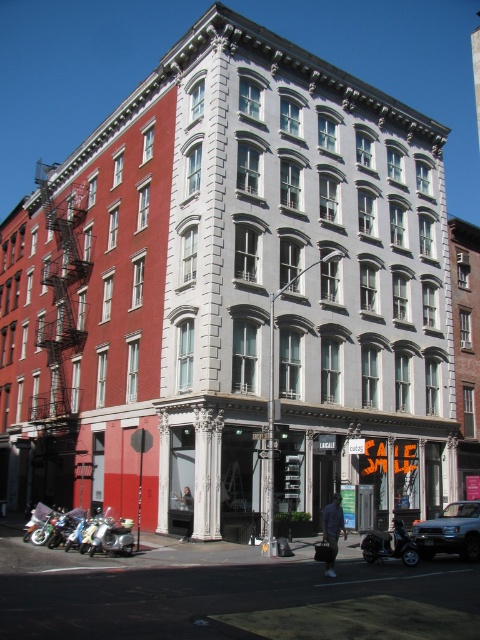
Is shiny chrome motorcycle at lower right to the right of shiny chrome motorcycle at lower left from the viewer's perspective?

Correct, you'll find shiny chrome motorcycle at lower right to the right of shiny chrome motorcycle at lower left.

Identify the location of shiny chrome motorcycle at lower right. (389, 545).

Who is higher up, shiny chrome motorcycle at lower right or silver metallic motorcycle at lower left?

silver metallic motorcycle at lower left

Identify the location of shiny chrome motorcycle at lower right. Image resolution: width=480 pixels, height=640 pixels. (389, 545).

Which is behind, point (383, 541) or point (112, 525)?

Positioned behind is point (112, 525).

Identify the location of shiny chrome motorcycle at lower right. (389, 545).

Does metallic silver suv at center have a larger size compared to shiny chrome motorcycle at lower left?

Indeed, metallic silver suv at center has a larger size compared to shiny chrome motorcycle at lower left.

Does point (444, 552) come behind point (79, 512)?

No, it is not.

Find the location of a particular element. The image size is (480, 640). metallic silver suv at center is located at coordinates (450, 531).

Locate an element on the screen. The width and height of the screenshot is (480, 640). metallic silver suv at center is located at coordinates (450, 531).